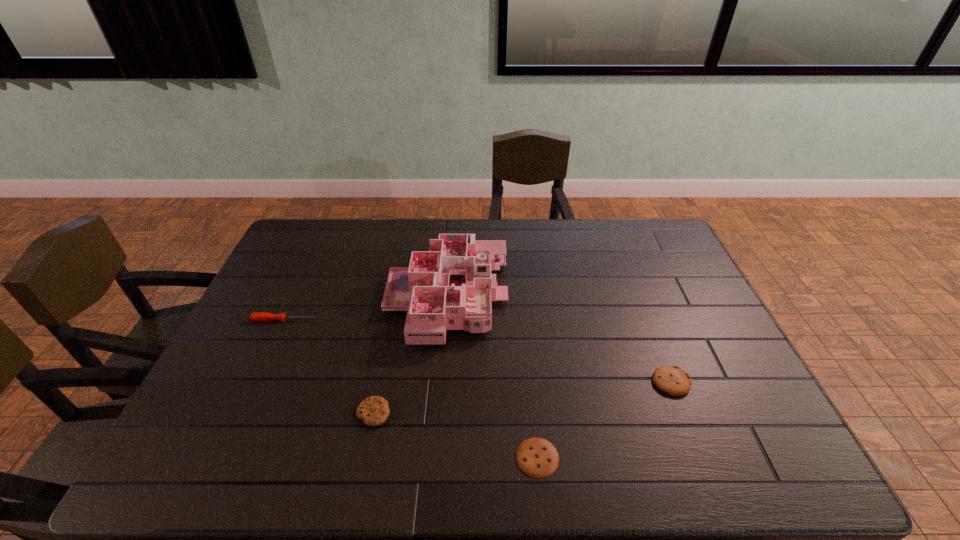
Where is `free space between the leftmost object and the tallest object`? The image size is (960, 540). free space between the leftmost object and the tallest object is located at coordinates (366, 309).

Choose which object is the second nearest neighbor to the second shortest cookie. Please provide its 2D coordinates. Your answer should be formatted as a tuple, i.e. [(x, y)], where the tuple contains the x and y coordinates of a point satisfying the conditions above.

[(538, 458)]

Image resolution: width=960 pixels, height=540 pixels. What are the coordinates of `object that is the closest to the second shortest cookie` in the screenshot? It's located at (450, 287).

Where is `cookie that is the closest to the second cookie from right to left`? This screenshot has width=960, height=540. cookie that is the closest to the second cookie from right to left is located at coordinates (674, 381).

Identify which cookie is the second nearest to the second shortest cookie. Please provide its 2D coordinates. Your answer should be formatted as a tuple, i.e. [(x, y)], where the tuple contains the x and y coordinates of a point satisfying the conditions above.

[(674, 381)]

The height and width of the screenshot is (540, 960). I want to click on free spot that satisfies the following two spatial constraints: 1. at the front entrance of the nearest object; 2. on the left side of the dollhouse, so click(435, 457).

Locate an element on the screen. Image resolution: width=960 pixels, height=540 pixels. blank area in the image that satisfies the following two spatial constraints: 1. at the tip of the leftmost object; 2. on the right side of the nearest cookie is located at coordinates 222,457.

You are a GUI agent. You are given a task and a screenshot of the screen. Output one action in this format:
    pyautogui.click(x=<x>, y=<y>)
    Task: Click on the vacant space that satisfies the following two spatial constraints: 1. on the back side of the tallest cookie; 2. at the front entrance of the tallest object
    The height and width of the screenshot is (540, 960).
    Given the screenshot: What is the action you would take?
    pyautogui.click(x=638, y=298)

The width and height of the screenshot is (960, 540). Find the location of `vacant area that satisfies the following two spatial constraints: 1. at the tip of the leftmost object; 2. on the right side of the shortest cookie`. vacant area that satisfies the following two spatial constraints: 1. at the tip of the leftmost object; 2. on the right side of the shortest cookie is located at coordinates (222, 457).

Find the location of a particular element. The width and height of the screenshot is (960, 540). vacant space that satisfies the following two spatial constraints: 1. on the back side of the nearest cookie; 2. at the tip of the leftmost object is located at coordinates (523, 320).